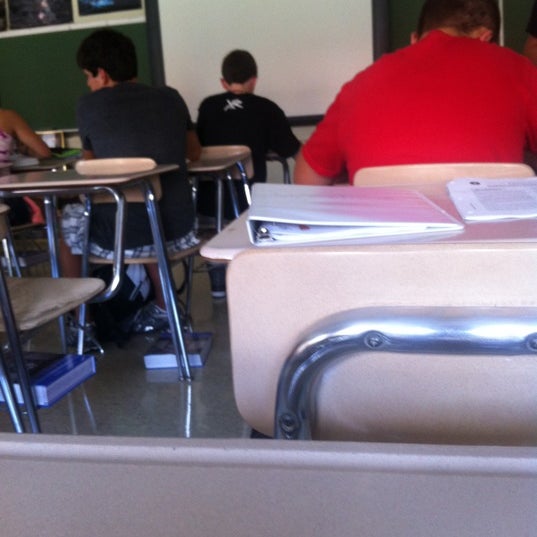
This screenshot has height=537, width=537. In order to click on books in this screenshot , I will do `click(47, 371)`, `click(164, 349)`, `click(25, 256)`.